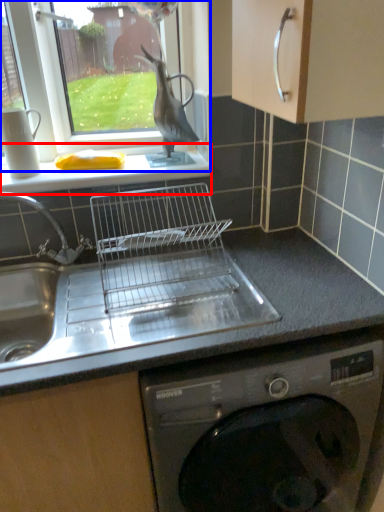
Question: Which point is further to the camera, window sill (highlighted by a red box) or window (highlighted by a blue box)?

Choices:
 (A) window sill
 (B) window

Answer: (A)